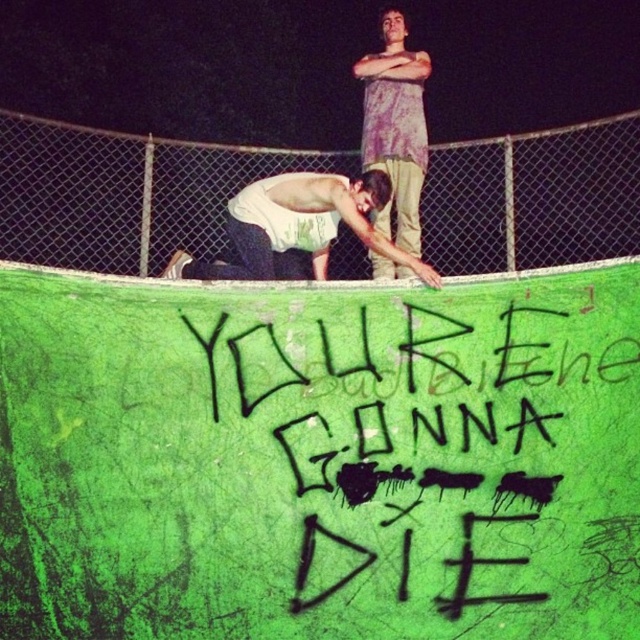
You are a photographer trying to capture the scene with a camera. If you focus on the black spray paint graffiti at center, will the white cotton shirt at center be in the background or foreground?

The black spray paint graffiti at center is in front of the white cotton shirt at center, so if you focus on the black spray paint graffiti at center, the white cotton shirt at center will be in the background.